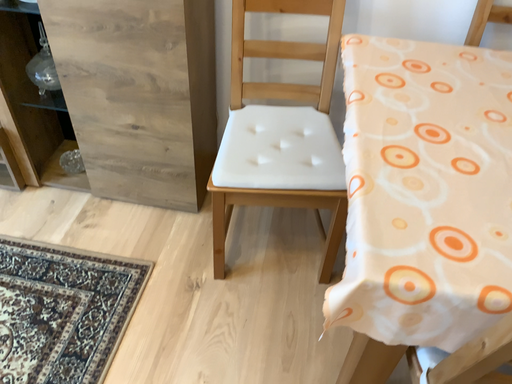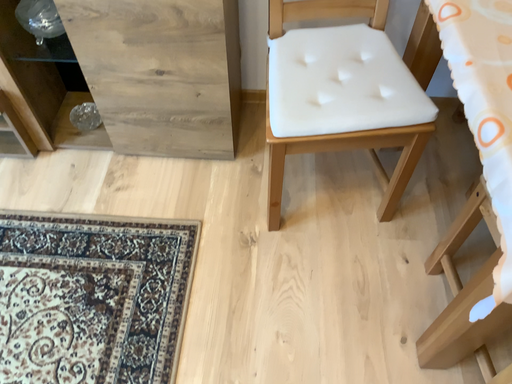
Question: How did the camera likely rotate when shooting the video?

Choices:
 (A) rotated upward
 (B) rotated downward

Answer: (B)